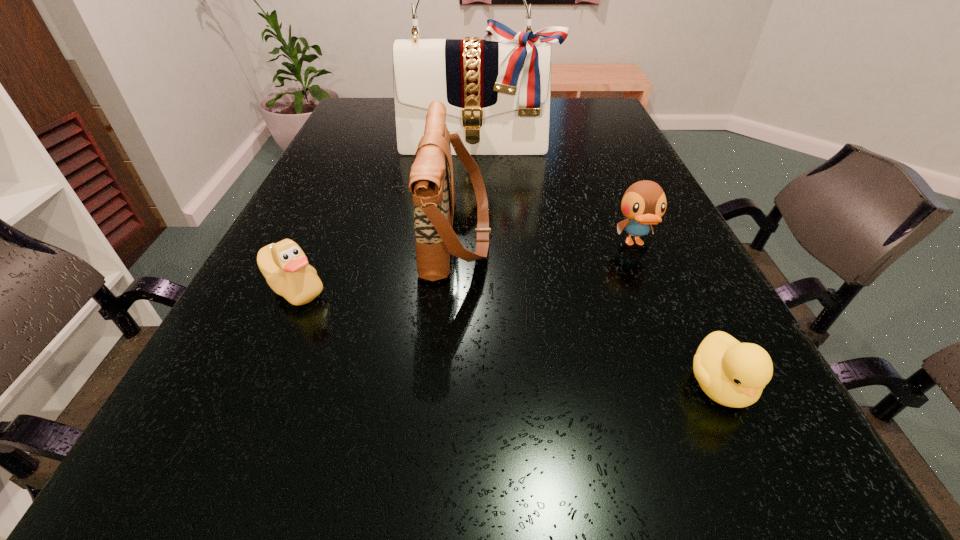
This screenshot has width=960, height=540. What are the coordinates of `the farthest object` in the screenshot? It's located at (497, 90).

This screenshot has width=960, height=540. I want to click on satchel, so click(497, 90).

Locate an element on the screen. This screenshot has width=960, height=540. the fourth shortest object is located at coordinates [431, 183].

What are the coordinates of `the farthest duck` in the screenshot? It's located at (644, 203).

Locate an element on the screen. The height and width of the screenshot is (540, 960). the second farthest duck is located at coordinates [x=284, y=265].

Find the location of a particular element. the leftmost duck is located at coordinates (284, 265).

At what (x,y) coordinates should I click in order to perform the action: click on the nearest object. Please return your answer as a coordinate pair (x, y). The image size is (960, 540). Looking at the image, I should click on (733, 374).

Locate an element on the screen. The image size is (960, 540). free location located on the front-facing side of the farthest object is located at coordinates (478, 191).

At what (x,y) coordinates should I click in order to perform the action: click on vacant space located on the front-facing side of the shoulder bag. Please return your answer as a coordinate pair (x, y). The width and height of the screenshot is (960, 540). Looking at the image, I should click on (575, 234).

I want to click on vacant space positioned on the front-facing side of the farthest duck, so click(x=718, y=440).